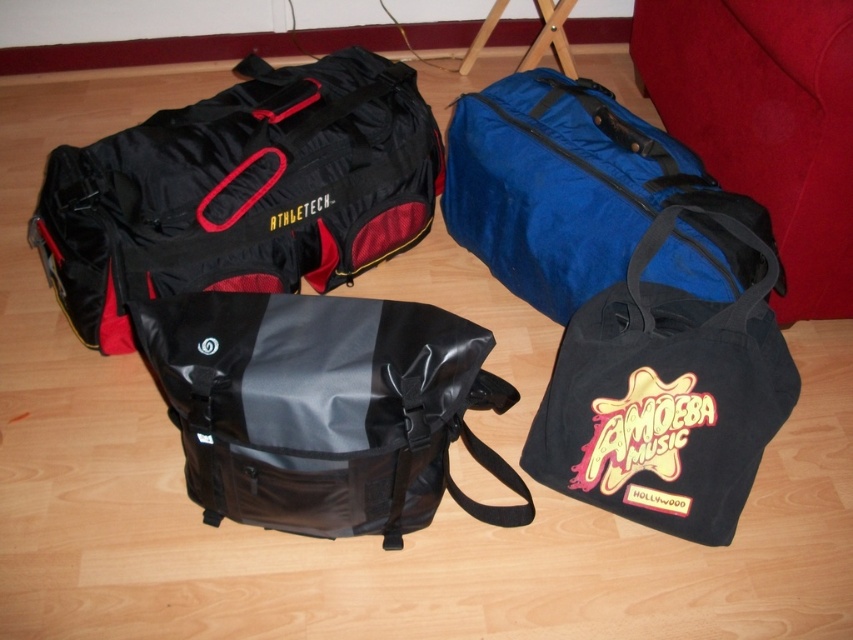
The height and width of the screenshot is (640, 853). I want to click on red fabric couch at upper right, so (764, 122).

Describe the element at coordinates (764, 122) in the screenshot. The height and width of the screenshot is (640, 853). I see `red fabric couch at upper right` at that location.

The width and height of the screenshot is (853, 640). In order to click on red fabric couch at upper right in this screenshot , I will do `click(764, 122)`.

Is black canvas tote at lower right wider than blue fabric duffel at upper right?

No, black canvas tote at lower right is not wider than blue fabric duffel at upper right.

I want to click on black canvas tote at lower right, so click(665, 396).

What do you see at coordinates (665, 396) in the screenshot? This screenshot has height=640, width=853. I see `black canvas tote at lower right` at bounding box center [665, 396].

You are a GUI agent. You are given a task and a screenshot of the screen. Output one action in this format:
    pyautogui.click(x=<x>, y=<y>)
    Task: Click on the black canvas tote at lower right
    The height and width of the screenshot is (640, 853).
    Given the screenshot: What is the action you would take?
    pyautogui.click(x=665, y=396)

Does blackwaterproofbackpack at center appear over red fabric couch at upper right?

Incorrect, blackwaterproofbackpack at center is not positioned above red fabric couch at upper right.

Is point (227, 406) less distant than point (712, 36)?

That is True.

At what (x,y) coordinates should I click in order to perform the action: click on blackwaterproofbackpack at center. Please return your answer as a coordinate pair (x, y). Image resolution: width=853 pixels, height=640 pixels. Looking at the image, I should click on (323, 408).